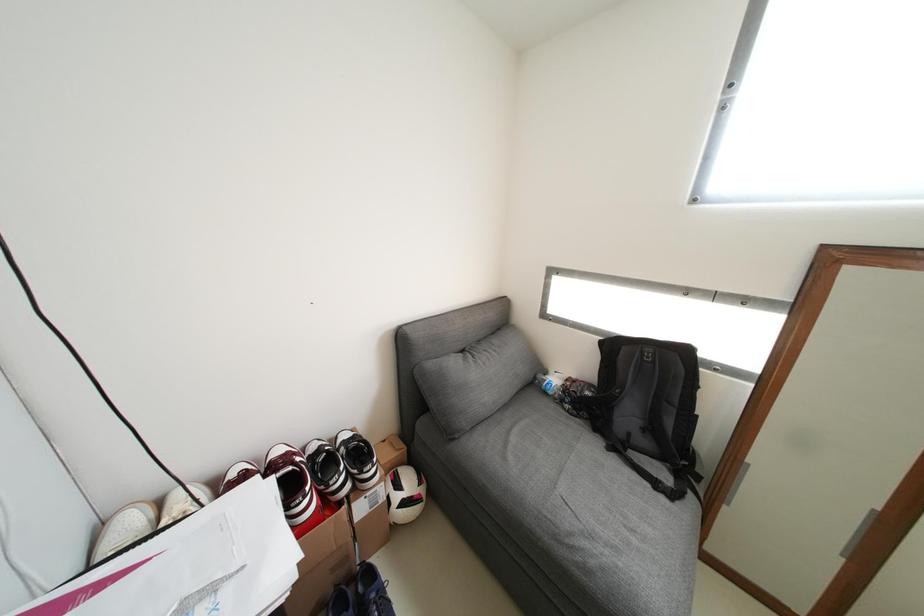
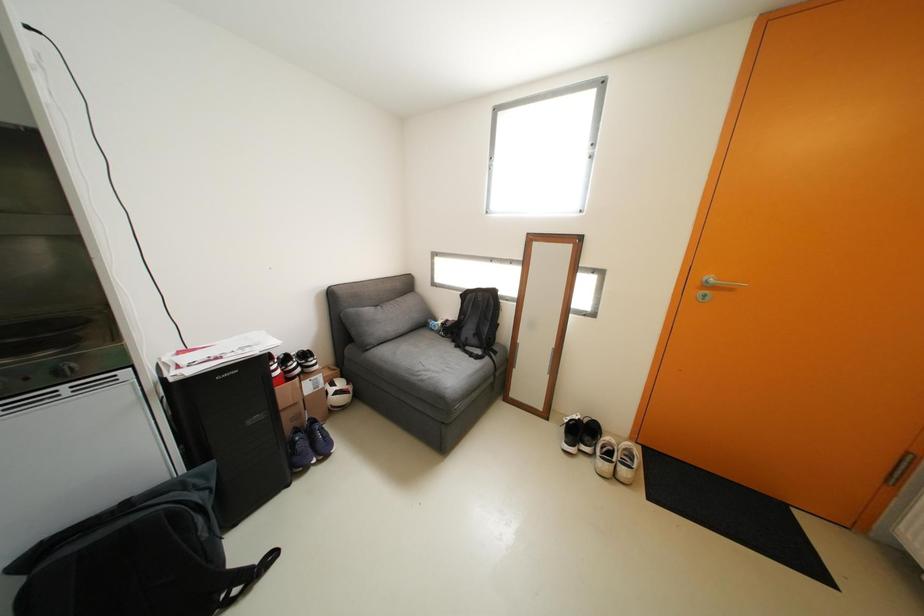
In a continuous first-person perspective shot, in which direction is the camera moving?

The movement direction of the cameraman is right, backward.